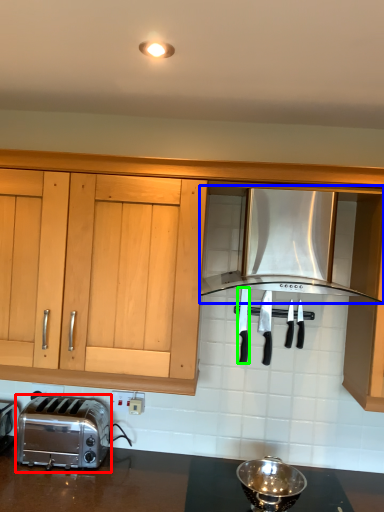
Question: Which object is positioned closest to toaster (highlighted by a red box)? Select from kitchen appliance (highlighted by a blue box) and silverware (highlighted by a green box).

Choices:
 (A) kitchen appliance
 (B) silverware

Answer: (B)